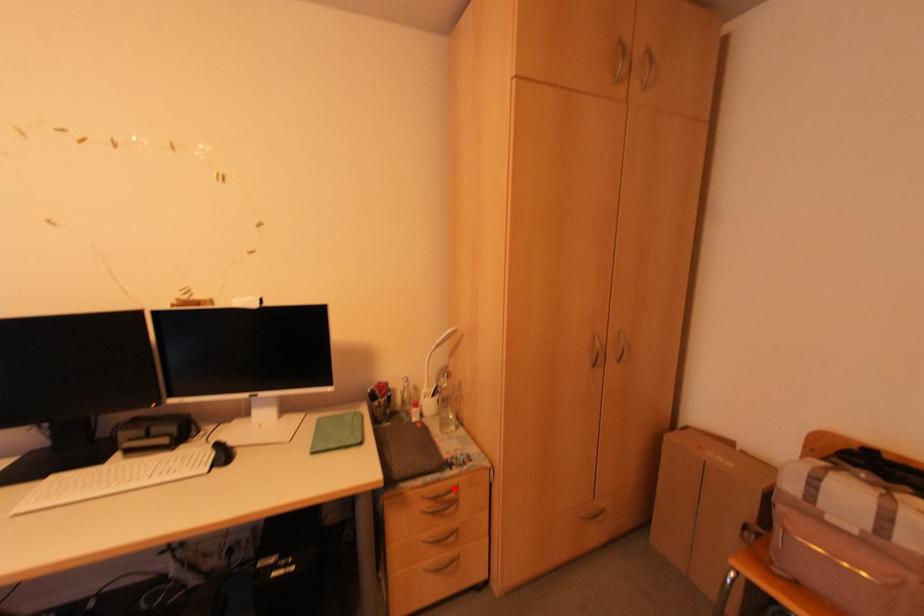
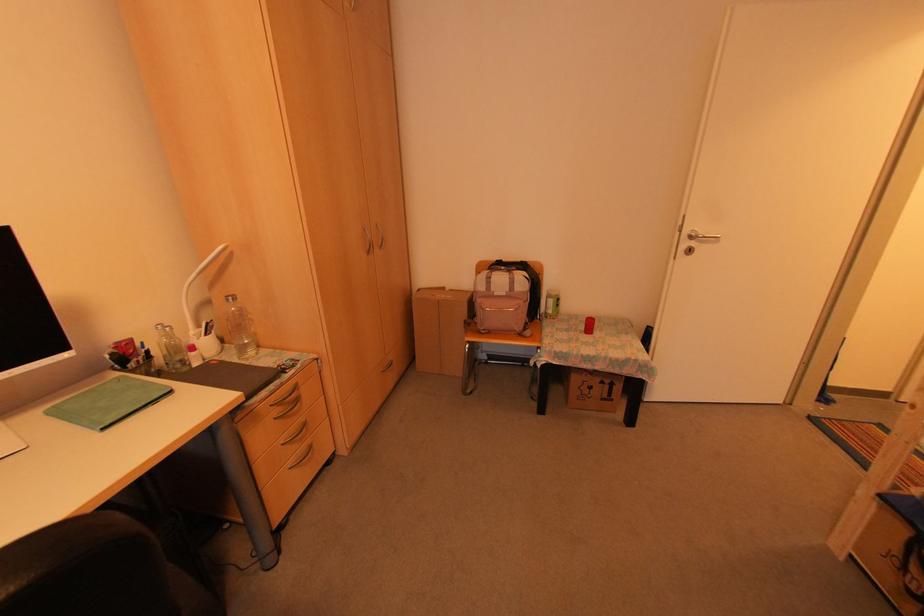
Question: I am providing you with two images of the same scene from different viewpoints. A red point is shown in image1. For the corresponding object point in image2, is it positioned nearer or farther from the camera?

Choices:
 (A) Nearer
 (B) Farther

Answer: (A)